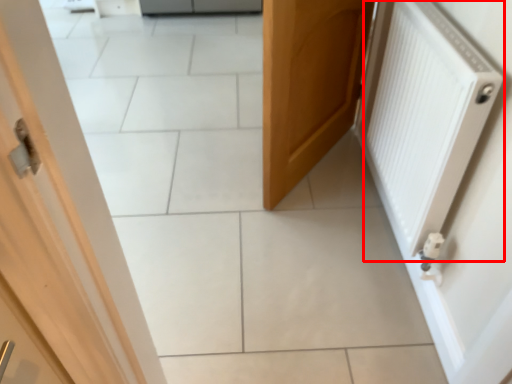
Question: In this image, where is radiator (annotated by the red box) located relative to door?

Choices:
 (A) right
 (B) left

Answer: (A)